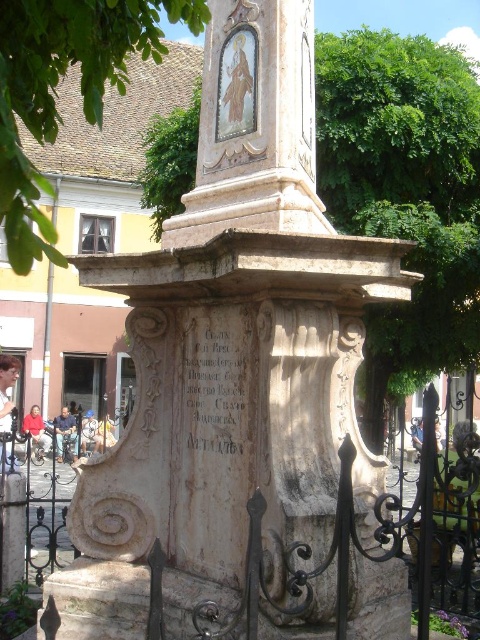
Which is in front, point (379, 234) or point (208, 320)?

Point (208, 320) is in front.

Looking at this image, which of these two, green leafy tree at upper center or stone inscription at center, stands taller?

Standing taller between the two is green leafy tree at upper center.

Does point (397, 44) come behind point (248, 356)?

Yes.

This screenshot has width=480, height=640. In order to click on green leafy tree at upper center in this screenshot , I will do `click(406, 192)`.

Is green leafy tree at upper left further to camera compared to stone inscription at center?

That is False.

Looking at this image, between green leafy tree at upper left and stone inscription at center, which one has more height?

With more height is green leafy tree at upper left.

Does point (35, 10) come in front of point (240, 401)?

Yes, it is.

You are a GUI agent. You are given a task and a screenshot of the screen. Output one action in this format:
    pyautogui.click(x=<x>, y=<y>)
    Task: Click on the green leafy tree at upper left
    
    Given the screenshot: What is the action you would take?
    pyautogui.click(x=56, y=90)

Does green leafy tree at upper center have a greater height compared to green leafy tree at upper left?

Correct, green leafy tree at upper center is much taller as green leafy tree at upper left.

Between point (182, 157) and point (50, 188), which one is positioned in front?

Point (182, 157)

Where is `green leafy tree at upper center`? The image size is (480, 640). green leafy tree at upper center is located at coordinates (406, 192).